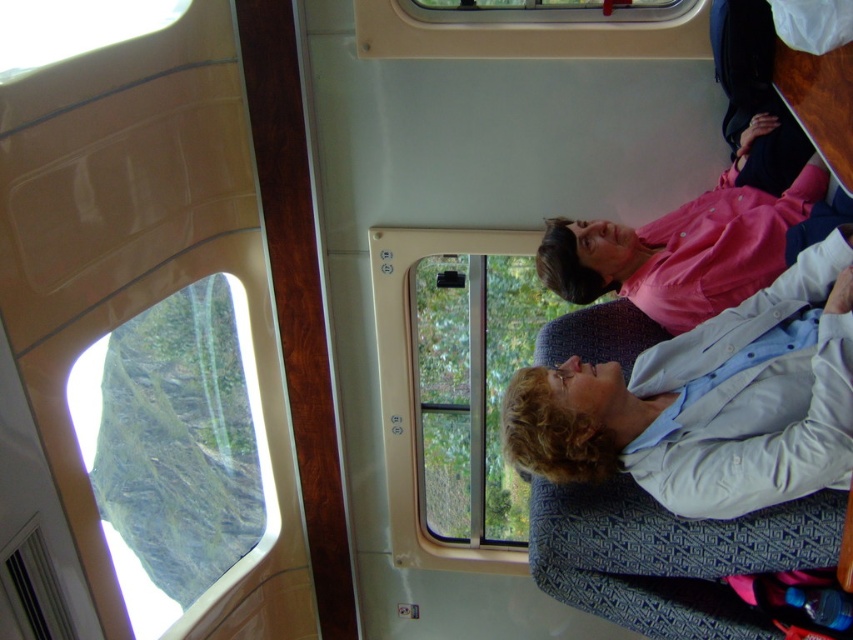
Is light blue fabric shirt at center positioned before transparent glass window at center?

Yes, it is in front of transparent glass window at center.

Which is in front, point (614, 385) or point (509, 362)?

Point (614, 385) is in front.

Describe the element at coordinates (709, 403) in the screenshot. I see `light blue fabric shirt at center` at that location.

Where is `light blue fabric shirt at center`? light blue fabric shirt at center is located at coordinates (709, 403).

Between transparent glass window at center and pink matte shirt at upper right, which one is positioned lower?

transparent glass window at center is lower down.

Which is above, transparent glass window at center or pink matte shirt at upper right?

pink matte shirt at upper right is higher up.

Does point (469, 472) come farther from viewer compared to point (833, 221)?

Yes, point (469, 472) is farther from viewer.

At what (x,y) coordinates should I click in order to perform the action: click on transparent glass window at center. Please return your answer as a coordinate pair (x, y). Looking at the image, I should click on (473, 388).

In the scene shown: Which is above, light blue fabric shirt at center or transparent glass window at lower left?

light blue fabric shirt at center is higher up.

Between light blue fabric shirt at center and transparent glass window at lower left, which one appears on the right side from the viewer's perspective?

Positioned to the right is light blue fabric shirt at center.

Is point (840, 429) positioned after point (167, 348)?

No.

You are a GUI agent. You are given a task and a screenshot of the screen. Output one action in this format:
    pyautogui.click(x=<x>, y=<y>)
    Task: Click on the light blue fabric shirt at center
    This screenshot has height=640, width=853.
    Given the screenshot: What is the action you would take?
    pyautogui.click(x=709, y=403)